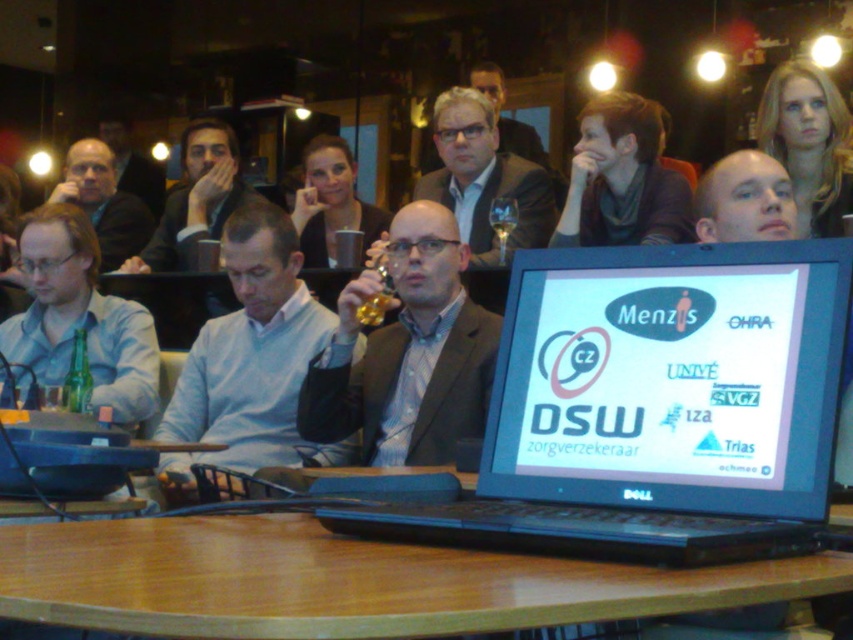
Who is lower down, wooden table at center or matte gray shirt at upper center?

wooden table at center is below.

Find the location of `wooden table at center`. wooden table at center is located at coordinates (347, 580).

You are a GUI agent. You are given a task and a screenshot of the screen. Output one action in this format:
    pyautogui.click(x=<x>, y=<y>)
    Task: Click on the wooden table at center
    
    Given the screenshot: What is the action you would take?
    pyautogui.click(x=347, y=580)

Which is in front, point (102, 173) or point (126, 138)?

Point (102, 173)

Which is behind, point (120, 230) or point (125, 150)?

Point (125, 150)

Does point (141, 221) lie behind point (120, 154)?

No.

In order to click on matte black jacket at upper left in this screenshot , I will do `click(103, 202)`.

Is the position of matte brown suit at center less distant than that of matte black jacket at upper center?

Yes, it is in front of matte black jacket at upper center.

Is matte brown suit at center below matte black jacket at upper center?

Yes, matte brown suit at center is below matte black jacket at upper center.

Does point (360, 362) come farther from viewer compared to point (155, 214)?

No, it is not.

This screenshot has height=640, width=853. I want to click on matte brown suit at center, so click(x=407, y=353).